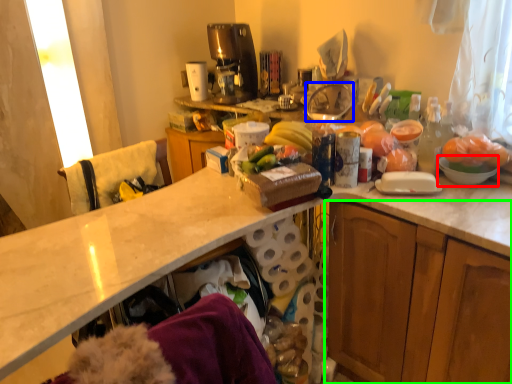
Question: Which is farther away from mixing bowl (highlighted by a red box)? appliance (highlighted by a blue box) or cabinetry (highlighted by a green box)?

Choices:
 (A) appliance
 (B) cabinetry

Answer: (A)